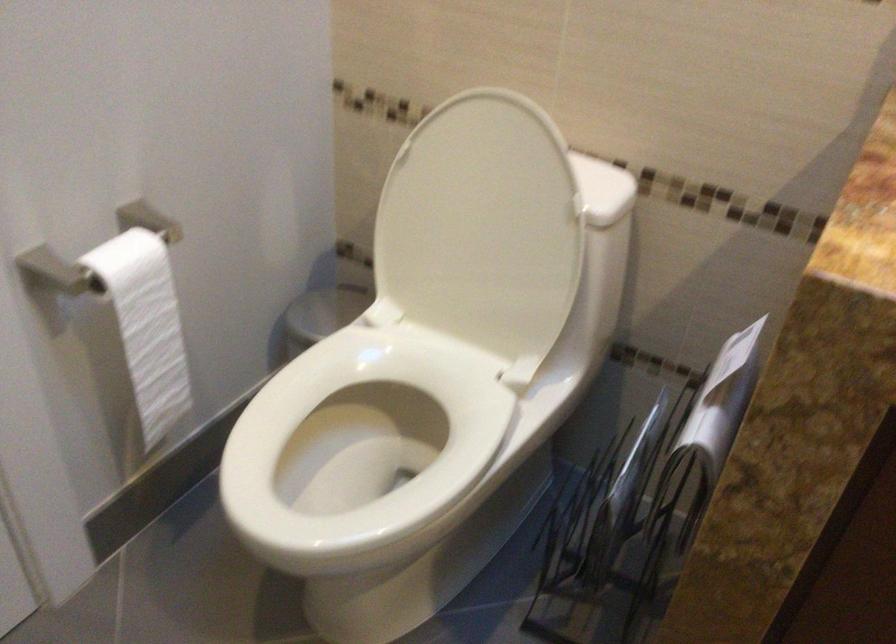
Locate an element on the screen. This screenshot has height=644, width=896. white toilet lid is located at coordinates (483, 228).